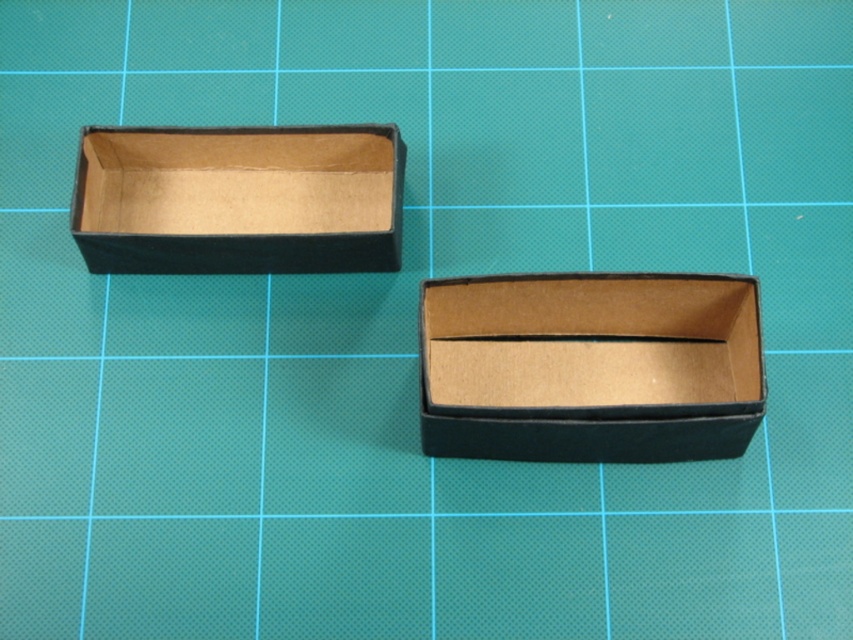
You are organizing a storage area and need to place the matte cardboard box at center and the matte black box at upper left. Based on their positions, which box should you move first to access the one behind?

The matte black box at upper left is behind the matte cardboard box at center, so you should move the matte cardboard box at center first to access the matte black box at upper left.

You are an online seller preparing to ship two items. You have a matte cardboard box at center and a matte black box at upper left. The items you need to ship are 14 inches long. Can you fit both items into the space between the two boxes without overlapping?

The distance between the matte cardboard box at center and the matte black box at upper left is 13.72 inches. Since the items are 14 inches long, they cannot fit between the two boxes without overlapping.

Consider the image. You are designing a packaging layout and need to place both the matte cardboard box at center and the matte black box at upper left on a shelf. Given their widths, which box should you place first to ensure they fit side by side without overlapping?

The matte cardboard box at center has a lesser width compared to matte black box at upper left. Therefore, you should place the matte black box at upper left first, as it is wider, followed by the narrower matte cardboard box at center to ensure they fit side by side without overlapping.